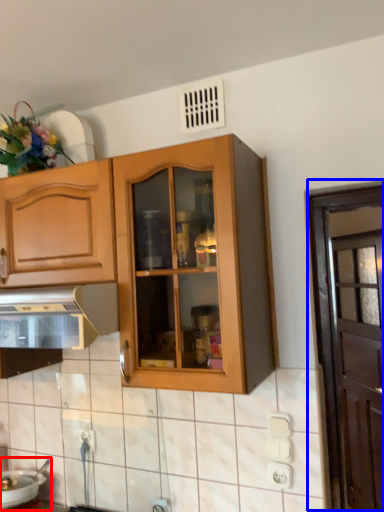
Question: Which point is closer to the camera, sink (highlighted by a red box) or door (highlighted by a blue box)?

Choices:
 (A) sink
 (B) door

Answer: (A)